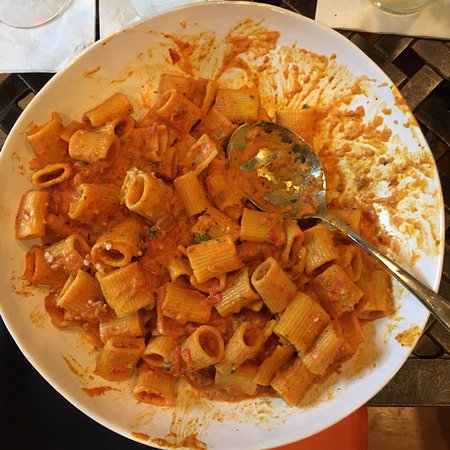
The width and height of the screenshot is (450, 450). I want to click on wine glass, so 30,13.